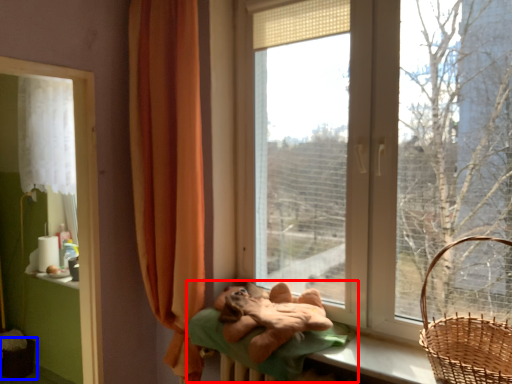
Question: Which object appears farthest to the camera in this image, bed (highlighted by a red box) or basket container (highlighted by a blue box)?

Choices:
 (A) bed
 (B) basket container

Answer: (B)